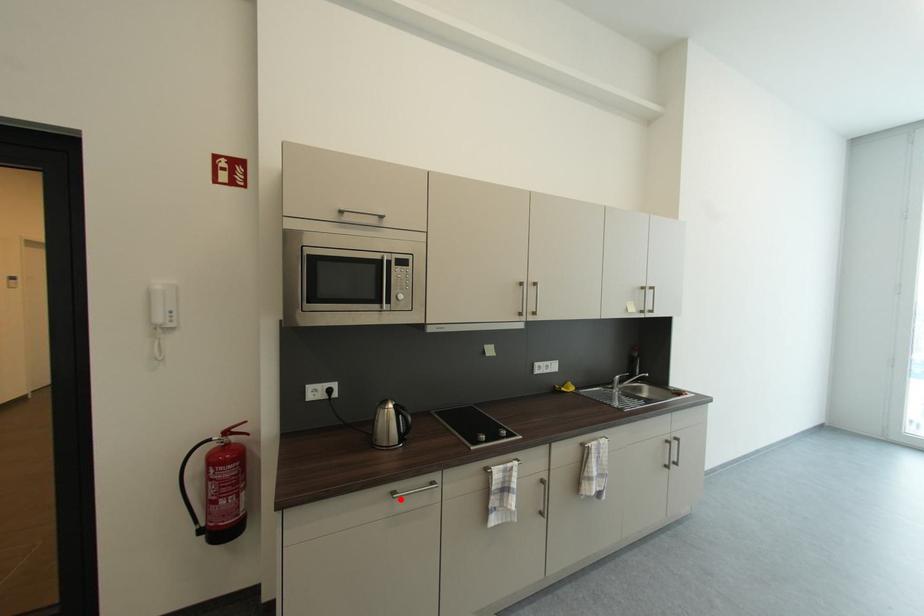
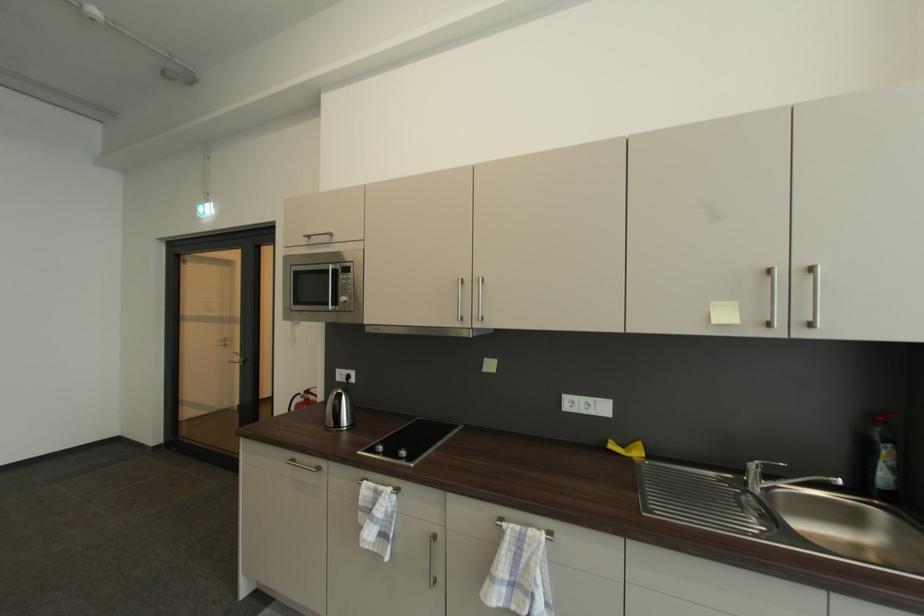
Where in the second image is the point corresponding to the highlighted location from the first image?

(295, 464)